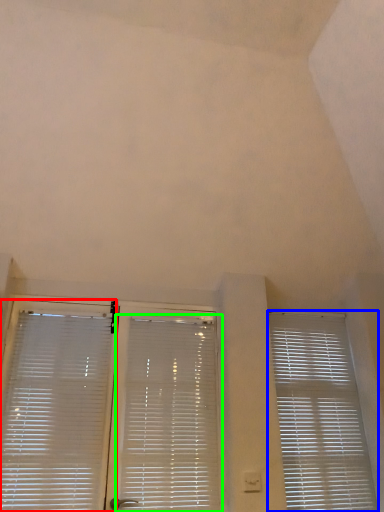
Question: Considering the real-world distances, which object is farthest from window blind (highlighted by a red box)? window blind (highlighted by a blue box) or window blind (highlighted by a green box)?

Choices:
 (A) window blind
 (B) window blind

Answer: (A)